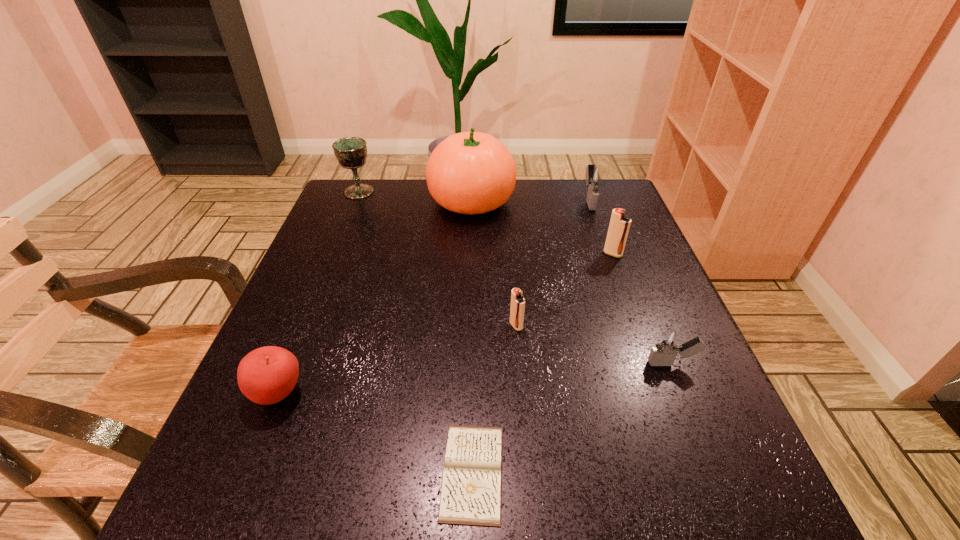
Where is `blank space at the left edge of the desktop`? The image size is (960, 540). blank space at the left edge of the desktop is located at coordinates pyautogui.click(x=348, y=289).

At what (x,y) coordinates should I click in order to perform the action: click on vacant region at the right edge of the desktop. Please return your answer as a coordinate pair (x, y). The height and width of the screenshot is (540, 960). Looking at the image, I should click on (699, 443).

At what (x,y) coordinates should I click in order to perform the action: click on free space at the far left corner of the desktop. Please return your answer as a coordinate pair (x, y). The image size is (960, 540). Looking at the image, I should click on (350, 208).

Image resolution: width=960 pixels, height=540 pixels. I want to click on vacant region at the near left corner of the desktop, so click(x=217, y=525).

Image resolution: width=960 pixels, height=540 pixels. I want to click on vacant space at the near right corner, so 668,516.

You are a GUI agent. You are given a task and a screenshot of the screen. Output one action in this format:
    pyautogui.click(x=<x>, y=<y>)
    Task: Click on the unoccupied area between the pumpkin and the red apple
    The width and height of the screenshot is (960, 540).
    Given the screenshot: What is the action you would take?
    pyautogui.click(x=374, y=297)

The width and height of the screenshot is (960, 540). Find the location of `free point between the nearest igniter and the shortest object`. free point between the nearest igniter and the shortest object is located at coordinates (572, 418).

The image size is (960, 540). What are the coordinates of `empty location between the second nearest igniter and the nearer gray igniter` in the screenshot? It's located at (594, 345).

Locate an element on the screen. Image resolution: width=960 pixels, height=540 pixels. vacant space that is in between the farthest igniter and the pumpkin is located at coordinates [531, 200].

You are a GUI agent. You are given a task and a screenshot of the screen. Output one action in this format:
    pyautogui.click(x=<x>, y=<y>)
    Task: Click on the unoccupied area between the left red igniter and the chalice
    
    Given the screenshot: What is the action you would take?
    pyautogui.click(x=438, y=259)